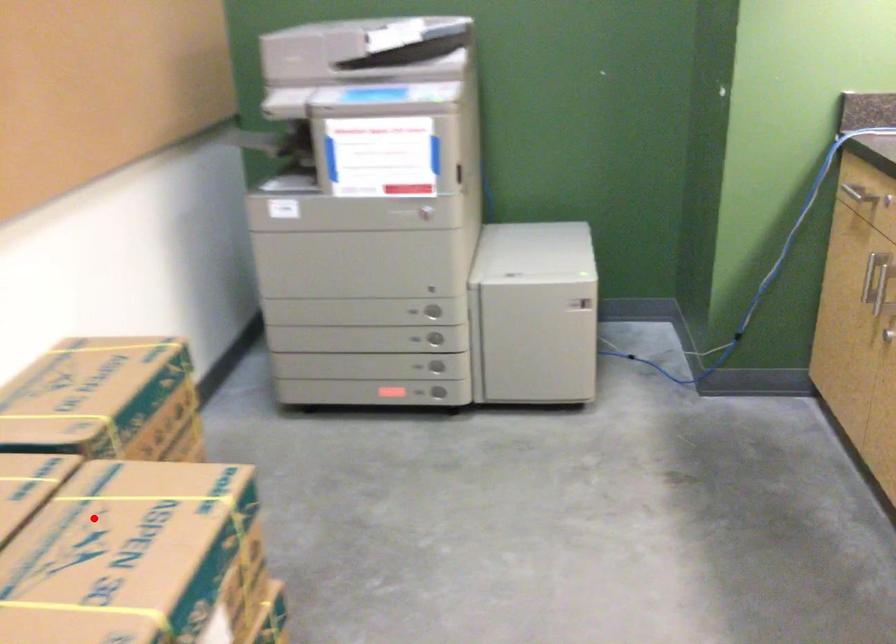
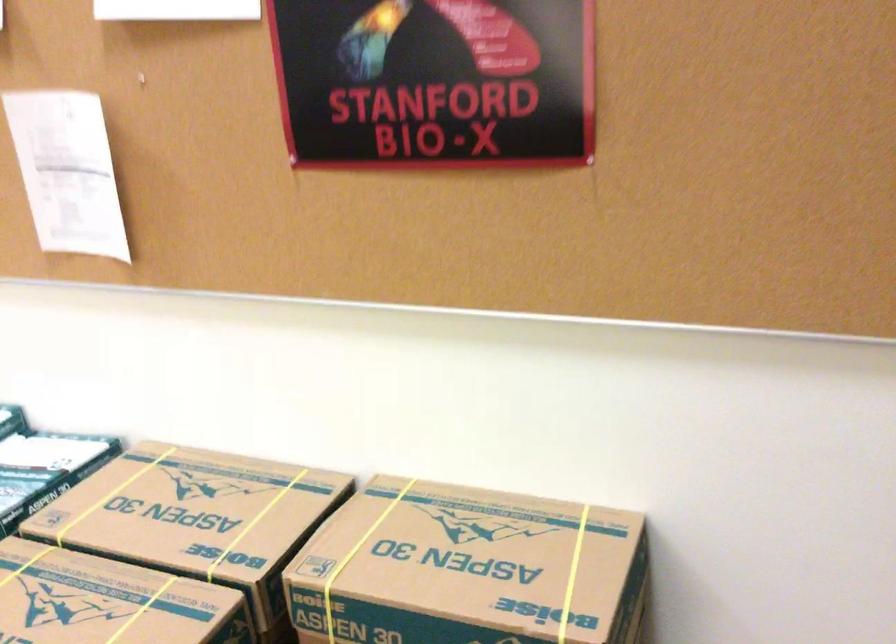
Question: A red point is marked in image1. In image2, is the corresponding 3D point closer to the camera or farther? Reply with the corresponding letter.

Choices:
 (A) The corresponding 3D point is closer.
 (B) The corresponding 3D point is farther.

Answer: (A)